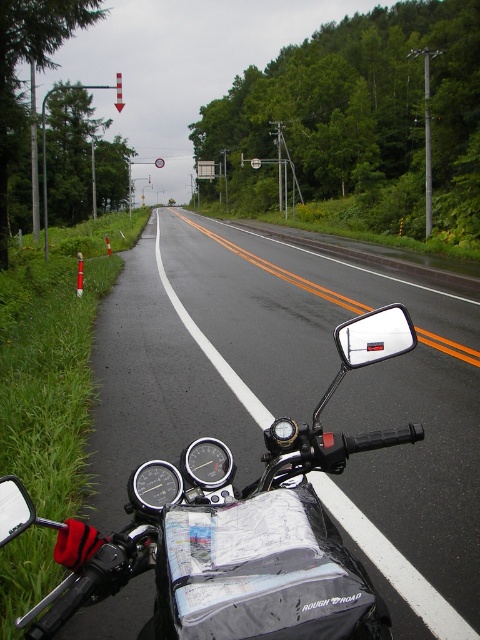
You are the motorcycle rider looking at the road ahead. There are two points marked on the road, one at coordinates point (50,621) and the other at point (377,349). Which point is closer to your motorcycle?

Point (50,621) is closer to the camera than point (377,349), so the point at coordinates point (50,621) is closer to your motorcycle.

You are a motorcycle rider planning to park your black matte motorcycle at center on the side of the road. The parking area requires vehicles to be positioned within a 0.9 meter radius from the center point. Is the current position of your motorcycle within the allowed parking area?

The black matte motorcycle at center is positioned at point [223,544]. To determine if it is within a 0.9 meter radius, calculate the distance from the center point. The distance squared would be 0.850 squared plus 0.465 squared, which equals approximately 0.7225 plus 0.2162, totaling 0.9387. Since this exceeds 0.81, the square of 0.9, the motorcycle is outside the allowed parking area.

You are a motorcycle rider stopped at the side of the road. You want to check the distance from your current position to the point marked at coordinates point (x=316, y=468). Can you reach that point without moving your motorcycle?

The distance between you and the point (x=316, y=468) is 2.01 meters, so you cannot reach it without moving your motorcycle since it is too far away.